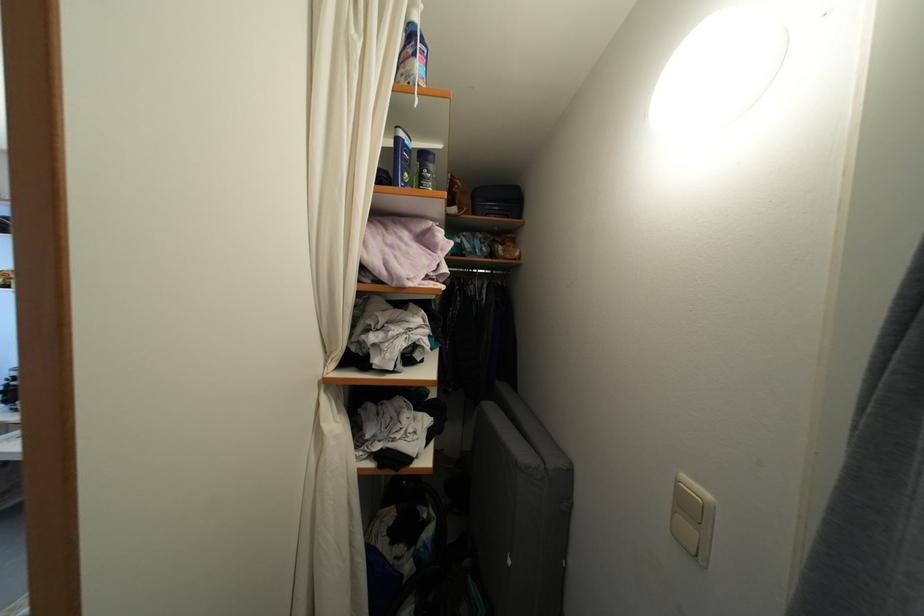
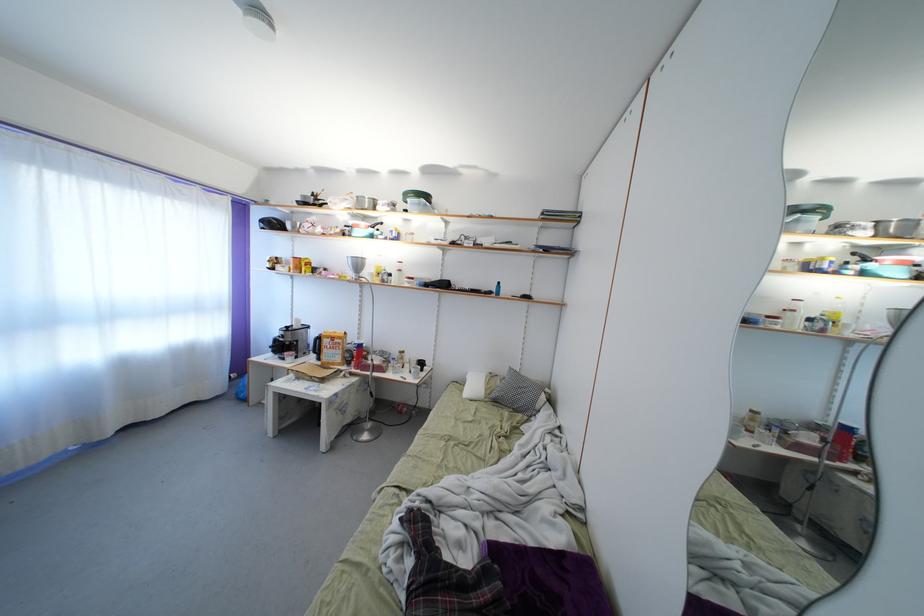
Question: The camera is either moving clockwise (left) or counter-clockwise (right) around the object. The first image is from the beginning of the video and the second image is from the end. Is the camera moving left or right when shooting the video?

Choices:
 (A) Left
 (B) Right

Answer: (B)